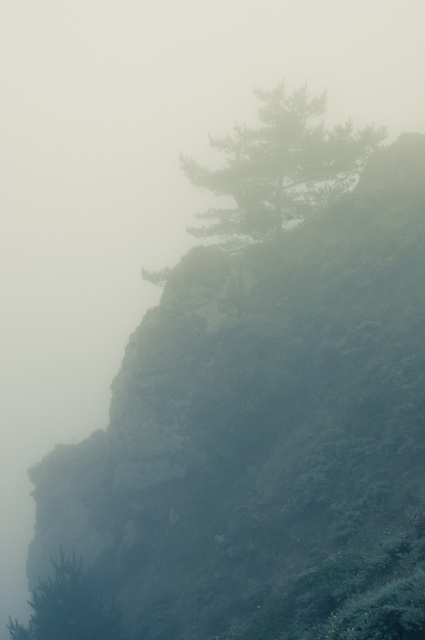
Question: Does green matte tree at upper center appear on the left side of green matte tree at lower left?

Choices:
 (A) yes
 (B) no

Answer: (B)

Question: Among these objects, which one is nearest to the camera?

Choices:
 (A) green matte tree at lower left
 (B) green matte tree at upper center

Answer: (A)

Question: Which object is closer to the camera taking this photo?

Choices:
 (A) green matte tree at upper center
 (B) green matte tree at lower left

Answer: (B)

Question: Can you confirm if green matte tree at upper center is bigger than green matte tree at lower left?

Choices:
 (A) yes
 (B) no

Answer: (A)

Question: Can you confirm if green matte tree at upper center is thinner than green matte tree at lower left?

Choices:
 (A) no
 (B) yes

Answer: (A)